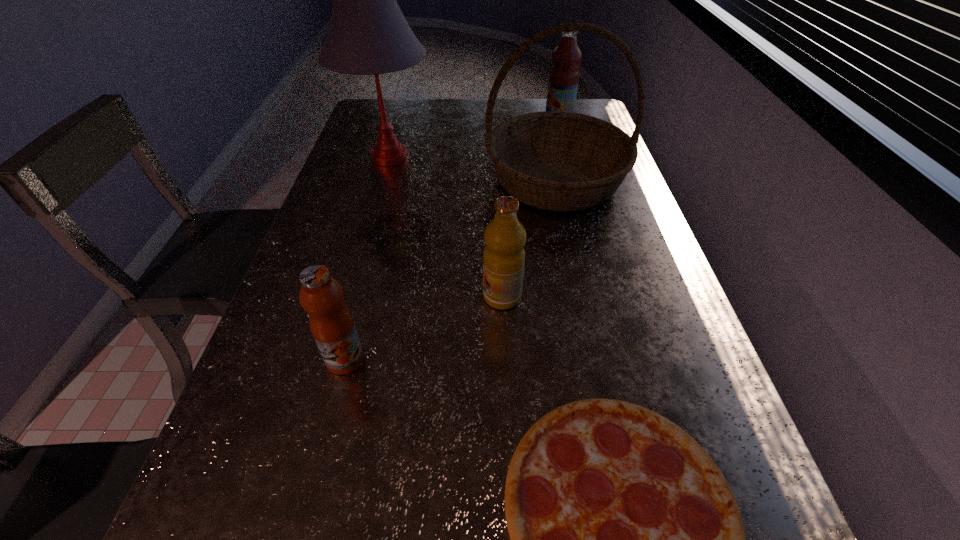
I want to click on vacant space that is in between the leftmost fruit juice and the second fruit juice from right to left, so click(423, 328).

Identify the location of object that is the third closest one to the rightmost fruit juice. The height and width of the screenshot is (540, 960). (504, 256).

Locate an element on the screen. The height and width of the screenshot is (540, 960). object that ranks as the second closest to the pizza is located at coordinates (331, 323).

Identify which fruit juice is the second closest to the nearest fruit juice. Please provide its 2D coordinates. Your answer should be formatted as a tuple, i.e. [(x, y)], where the tuple contains the x and y coordinates of a point satisfying the conditions above.

[(564, 75)]

Identify which fruit juice is the second closest to the nearest object. Please provide its 2D coordinates. Your answer should be formatted as a tuple, i.e. [(x, y)], where the tuple contains the x and y coordinates of a point satisfying the conditions above.

[(331, 323)]

Find the location of a particular element. free spot that satisfies the following two spatial constraints: 1. on the front-facing side of the basket; 2. on the left side of the table lamp is located at coordinates (383, 181).

Identify the location of free space in the image that satisfies the following two spatial constraints: 1. on the front label of the third tallest object; 2. on the front label of the leftmost fruit juice. (627, 360).

Where is `blank space that satisfies the following two spatial constraints: 1. on the front-facing side of the basket; 2. on the right side of the table lamp`? blank space that satisfies the following two spatial constraints: 1. on the front-facing side of the basket; 2. on the right side of the table lamp is located at coordinates (383, 181).

Locate an element on the screen. The width and height of the screenshot is (960, 540). free point that satisfies the following two spatial constraints: 1. on the front label of the rightmost fruit juice; 2. on the front label of the leftmost fruit juice is located at coordinates pos(627,360).